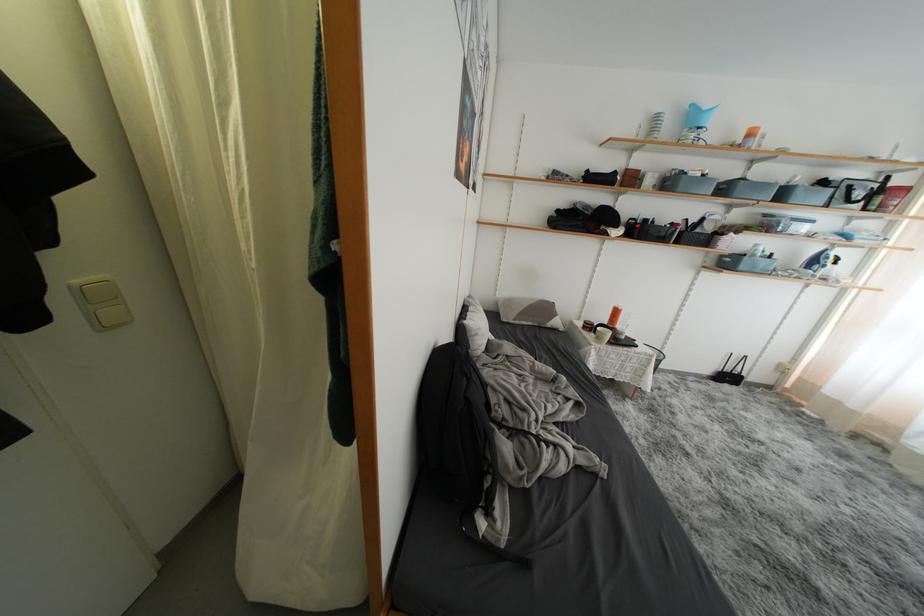
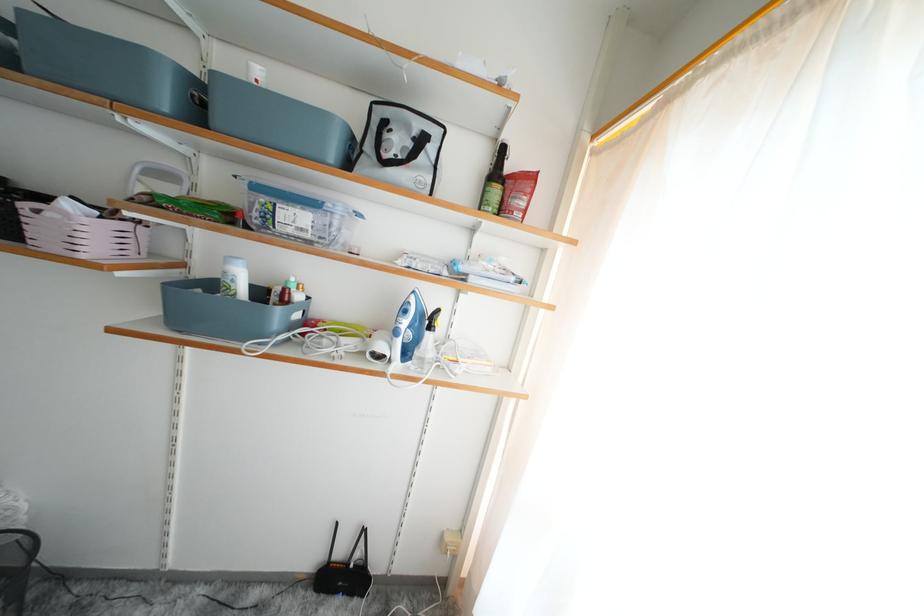
In a continuous first-person perspective shot, in which direction is the camera moving?

The cameraman walked toward right, forward.